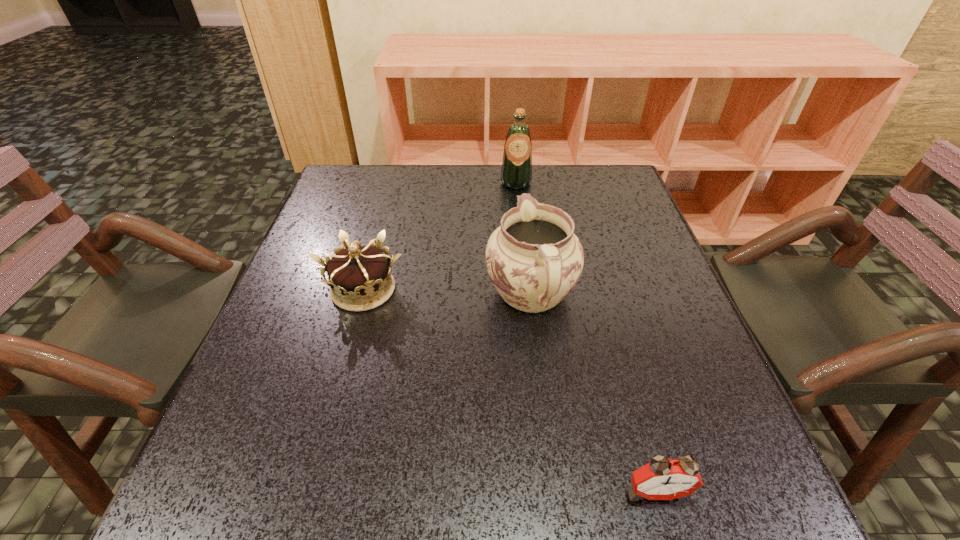
Find the location of a particular element. This screenshot has width=960, height=540. free region at the far right corner of the desktop is located at coordinates (591, 185).

The image size is (960, 540). Identify the location of free area in between the nearest object and the pitcher. (593, 394).

Identify the location of free point between the leftmost object and the alarm clock. (x=510, y=390).

You are a GUI agent. You are given a task and a screenshot of the screen. Output one action in this format:
    pyautogui.click(x=<x>, y=<y>)
    Task: Click on the free space between the rightmost object and the pitcher
    The image size is (960, 540).
    Given the screenshot: What is the action you would take?
    pyautogui.click(x=593, y=394)

The image size is (960, 540). I want to click on free space between the pitcher and the crown, so click(447, 293).

Where is `vacant space that is in between the crown and the farthest object`? The height and width of the screenshot is (540, 960). vacant space that is in between the crown and the farthest object is located at coordinates click(440, 237).

Image resolution: width=960 pixels, height=540 pixels. I want to click on free spot between the pitcher and the nearest object, so click(593, 394).

Locate an element on the screen. The image size is (960, 540). free spot between the pitcher and the crown is located at coordinates (447, 293).

At what (x,y) coordinates should I click in order to perform the action: click on free point between the nearest object and the crown. Please return your answer as a coordinate pair (x, y). This screenshot has height=540, width=960. Looking at the image, I should click on (510, 390).

Locate which object is the closest to the pitcher. Please provide its 2D coordinates. Your answer should be formatted as a tuple, i.e. [(x, y)], where the tuple contains the x and y coordinates of a point satisfying the conditions above.

[(360, 279)]